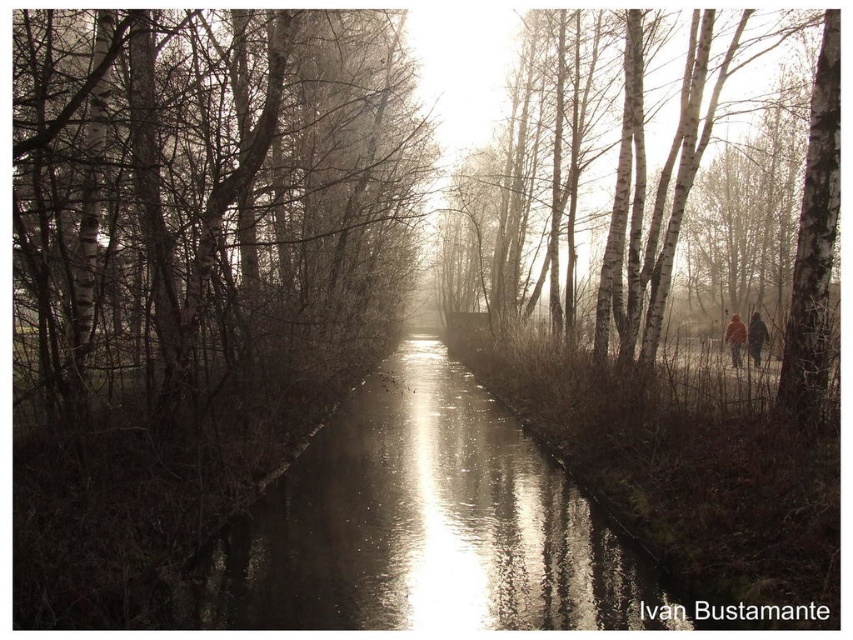
Is glistening reflective water at center thinner than white bark trees at center?

Yes.

Between point (543, 576) and point (775, 378), which one is positioned in front?

Positioned in front is point (543, 576).

Who is more forward, (351, 561) or (740, 256)?

Point (351, 561) is more forward.

At what (x,y) coordinates should I click in order to perform the action: click on glistening reflective water at center. Please return your answer as a coordinate pair (x, y). The height and width of the screenshot is (640, 853). Looking at the image, I should click on [x=425, y=524].

Does glistening reflective water at center have a lesser width compared to dark brown leather jacket at right?

In fact, glistening reflective water at center might be wider than dark brown leather jacket at right.

Can you confirm if glistening reflective water at center is positioned below dark brown leather jacket at right?

Yes.

Does point (271, 515) lie behind point (750, 353)?

No, it is not.

I want to click on glistening reflective water at center, so click(x=425, y=524).

Is smooth bark trees at center taller than brown leather jacket at right?

Yes, smooth bark trees at center is taller than brown leather jacket at right.

Does smooth bark trees at center appear on the right side of brown leather jacket at right?

No, smooth bark trees at center is not to the right of brown leather jacket at right.

The width and height of the screenshot is (853, 640). What do you see at coordinates (210, 218) in the screenshot?
I see `smooth bark trees at center` at bounding box center [210, 218].

The image size is (853, 640). I want to click on smooth bark trees at center, so click(210, 218).